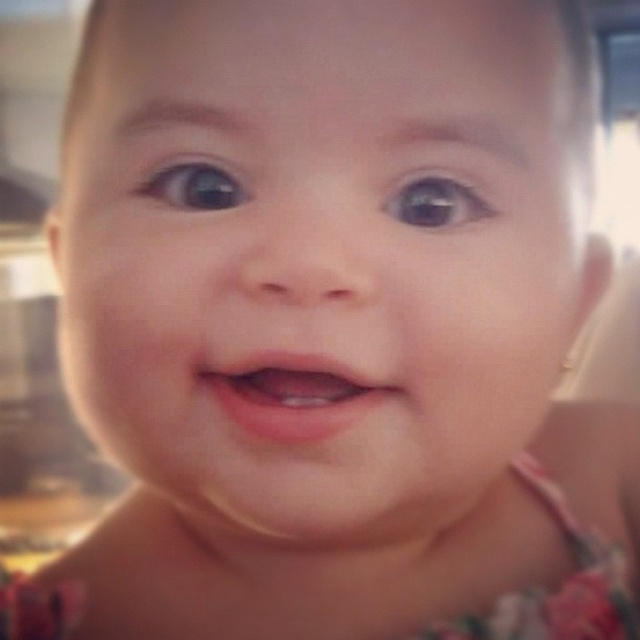
Question: Among these points, which one is farthest from the camera?

Choices:
 (A) (189, 176)
 (B) (404, 218)
 (C) (314, 368)
 (D) (308, 115)

Answer: (A)

Question: Is smooth skin baby at center above pink smooth lips at center?

Choices:
 (A) yes
 (B) no

Answer: (A)

Question: Does smooth skin baby at center have a larger size compared to blue glossy eye at upper center?

Choices:
 (A) yes
 (B) no

Answer: (A)

Question: Which object is farther from the camera taking this photo?

Choices:
 (A) brown glossy eye at upper center
 (B) blue glossy eye at upper center

Answer: (B)

Question: Which object is the farthest from the brown glossy eye at upper center?

Choices:
 (A) pink smooth lips at center
 (B) blue glossy eye at upper center
 (C) smooth skin baby at center

Answer: (C)

Question: Is pink smooth lips at center above blue glossy eye at upper center?

Choices:
 (A) no
 (B) yes

Answer: (A)